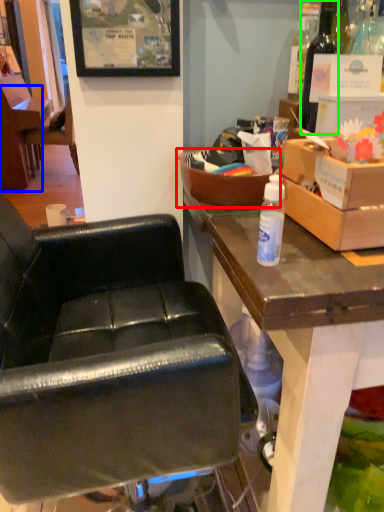
Question: Based on their relative distances, which object is nearer to box (highlighted by a red box)? Choose from chair (highlighted by a blue box) and bottle (highlighted by a green box).

Choices:
 (A) chair
 (B) bottle

Answer: (B)